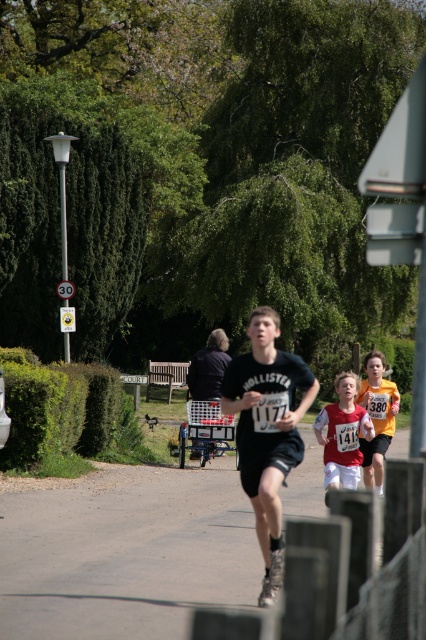
You are a runner participating in the race. You notice the smooth asphalt road at center and the matte black shirt at center. Which object is located to the right side from your perspective?

The matte black shirt at center is located to the right side of the smooth asphalt road at center.